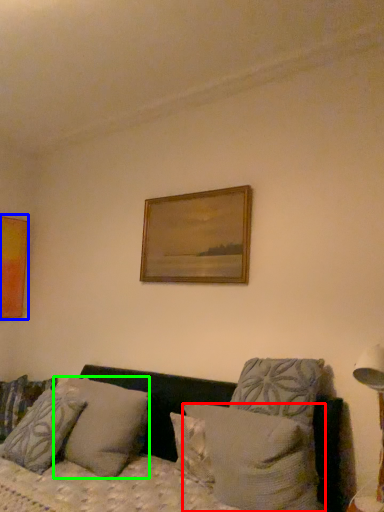
Question: Which object is positioned farthest from pillow (highlighted by a red box)? Select from picture frame (highlighted by a blue box) and pillow (highlighted by a green box).

Choices:
 (A) picture frame
 (B) pillow

Answer: (A)